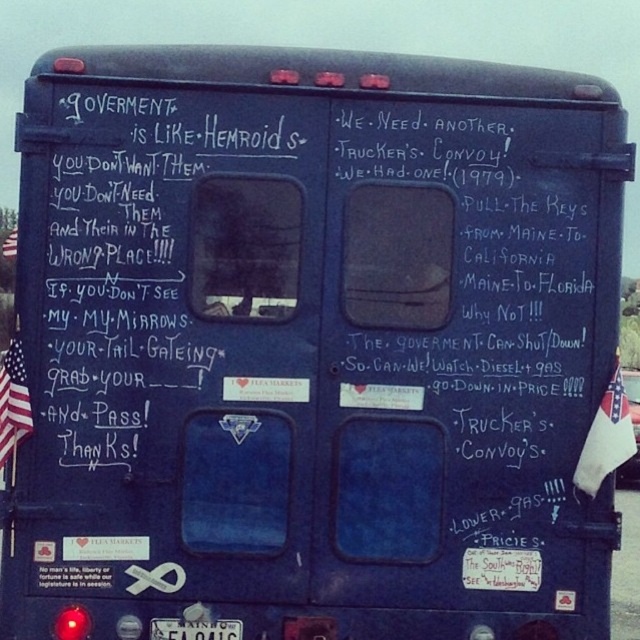
Question: Is the position of american flag at left more distant than that of white plastic license plate at lower center?

Choices:
 (A) no
 (B) yes

Answer: (A)

Question: Which object appears farthest from the camera in this image?

Choices:
 (A) american flag at left
 (B) american flag fabric at right
 (C) white plastic license plate at lower center

Answer: (C)

Question: Is american flag at left above white plastic license plate at lower center?

Choices:
 (A) no
 (B) yes

Answer: (B)

Question: Which of the following is the closest to the observer?

Choices:
 (A) american flag at left
 (B) american flag fabric at right

Answer: (B)

Question: Among these points, which one is nearest to the camera?

Choices:
 (A) (605, 426)
 (B) (218, 627)

Answer: (A)

Question: Is american flag fabric at right positioned behind white plastic license plate at lower center?

Choices:
 (A) no
 (B) yes

Answer: (A)